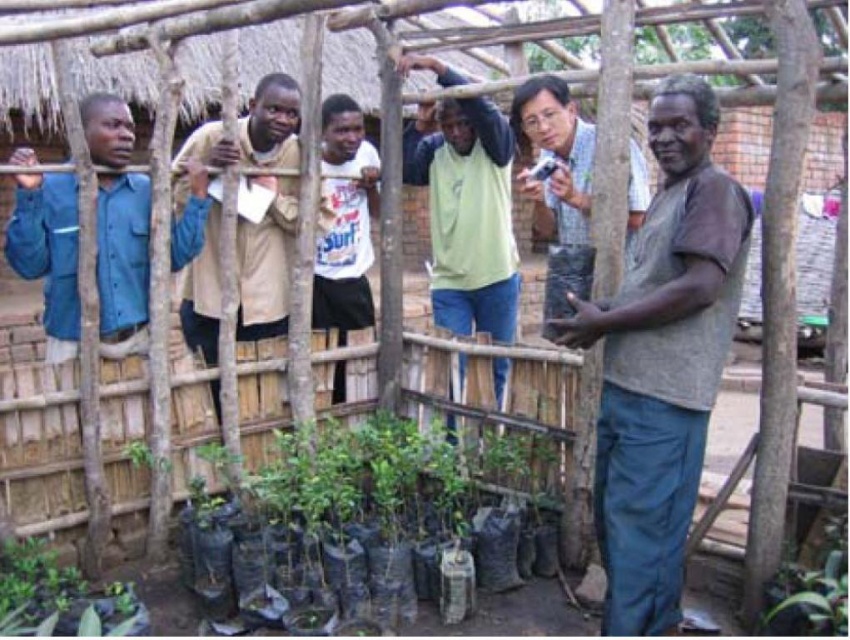
Question: Which object appears farthest from the camera in this image?

Choices:
 (A) gray matte shirt at center
 (B) green leafy plant at lower right
 (C) light brown shirt at center
 (D) green matte shirt at center

Answer: (D)

Question: Is green matte plant at lower center below light brown shirt at center?

Choices:
 (A) yes
 (B) no

Answer: (A)

Question: Is white matte shirt at center positioned before light brown shirt at center?

Choices:
 (A) no
 (B) yes

Answer: (A)

Question: Estimate the real-world distances between objects in this image. Which object is closer to the light brown shirt at center?

Choices:
 (A) white matte shirt at center
 (B) green matte plant at lower center
 (C) beige fabric shirt at center
 (D) green leafy plant at lower right

Answer: (A)

Question: Can you confirm if beige fabric shirt at center is positioned to the right of light brown shirt at center?

Choices:
 (A) yes
 (B) no

Answer: (B)

Question: Which of the following is the closest to the observer?

Choices:
 (A) (261, 100)
 (B) (683, 168)
 (C) (361, 273)

Answer: (B)